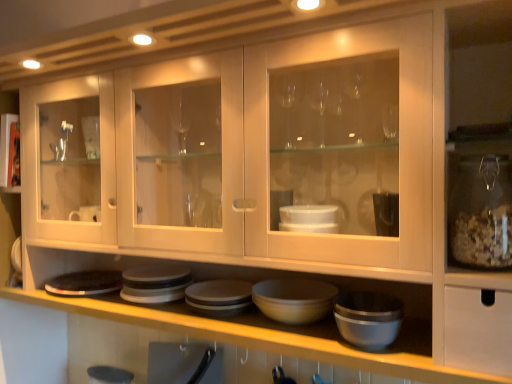
Question: Considering the relative sizes of matte gray bowl at center and matte gray platter at lower center in the image provided, is matte gray bowl at center wider than matte gray platter at lower center?

Choices:
 (A) yes
 (B) no

Answer: (B)

Question: Is the position of matte gray bowl at center more distant than that of matte gray platter at lower center?

Choices:
 (A) no
 (B) yes

Answer: (A)

Question: Is matte gray bowl at center not inside matte gray platter at lower center?

Choices:
 (A) no
 (B) yes

Answer: (B)

Question: From the image's perspective, is matte gray bowl at center beneath matte gray platter at lower center?

Choices:
 (A) no
 (B) yes

Answer: (A)

Question: Is matte gray bowl at center at the right side of matte gray platter at lower center?

Choices:
 (A) no
 (B) yes

Answer: (B)

Question: Does matte gray bowl at center contain matte gray platter at lower center?

Choices:
 (A) no
 (B) yes

Answer: (A)

Question: Does matte gray platter at lower center have a lesser width compared to matte gray bowl at center?

Choices:
 (A) yes
 (B) no

Answer: (B)

Question: From a real-world perspective, does matte gray platter at lower center stand above matte gray bowl at center?

Choices:
 (A) no
 (B) yes

Answer: (A)

Question: Is matte gray platter at lower center to the left of matte gray bowl at center from the viewer's perspective?

Choices:
 (A) yes
 (B) no

Answer: (A)

Question: Is matte gray bowl at center a part of matte gray platter at lower center?

Choices:
 (A) no
 (B) yes

Answer: (A)

Question: Is matte gray platter at lower center smaller than matte gray bowl at center?

Choices:
 (A) yes
 (B) no

Answer: (A)

Question: Does matte gray platter at lower center have a greater height compared to matte gray bowl at center?

Choices:
 (A) yes
 (B) no

Answer: (B)

Question: In terms of height, does matte gray bowl at center look taller or shorter compared to matte gray platter at lower center?

Choices:
 (A) tall
 (B) short

Answer: (A)